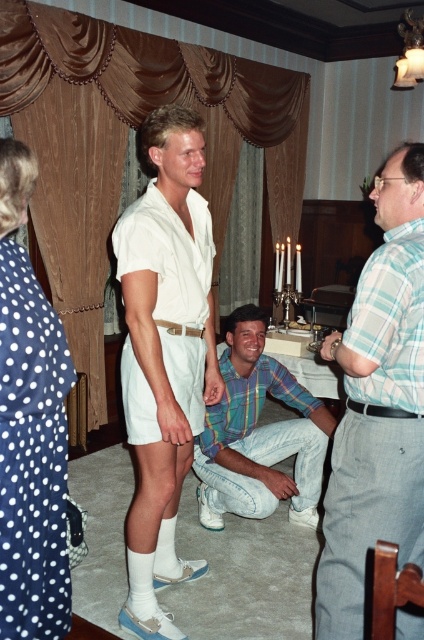
You are at a party and want to greet the person in the plaid shirt at center and the person in the white polka dot dress at left. If you are standing in the middle of the room, which direction should you walk to reach each of them?

To reach the plaid shirt at center, walk towards the center of the room. To reach the white polka dot dress at left, walk to the left side of the frame since the plaid shirt at center is to the right of the white polka dot dress at left.

You are a photographer trying to capture a clear shot of both the white matte shorts at center and the white polka dot dress at left. However, you notice that one of the objects is blocking the other. Which object is being obscured by the other?

The white matte shorts at center is positioned over white polka dot dress at left, so the white polka dot dress at left is being obscured by the white matte shorts at center.

You are a photographer trying to capture a candid shot of the people at the gathering. You notice the white matte shorts at center and the plaid shirt at center in your viewfinder. Which clothing item is positioned higher in the frame?

The white matte shorts at center is located above the plaid shirt at center, so it is positioned higher in the frame.